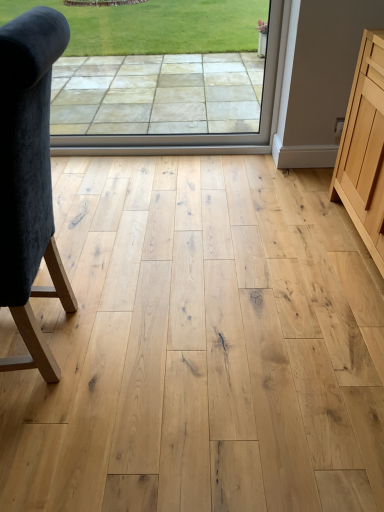
Where is `free location to the right of velvet dark blue chair at left`? The width and height of the screenshot is (384, 512). free location to the right of velvet dark blue chair at left is located at coordinates click(157, 343).